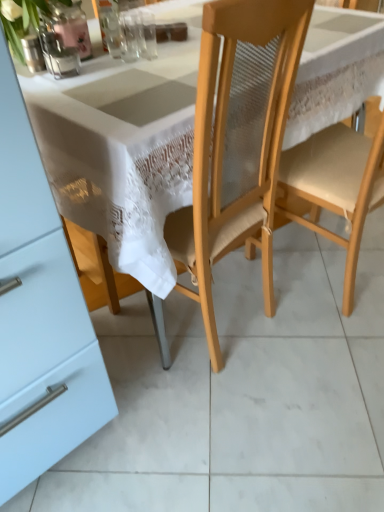
This screenshot has width=384, height=512. Identify the location of free area in between light wood chair at center, the 2th chair in the left-to-right sequence, and wooden chair at center, which ranks as the 2th chair in right-to-left order. (277, 322).